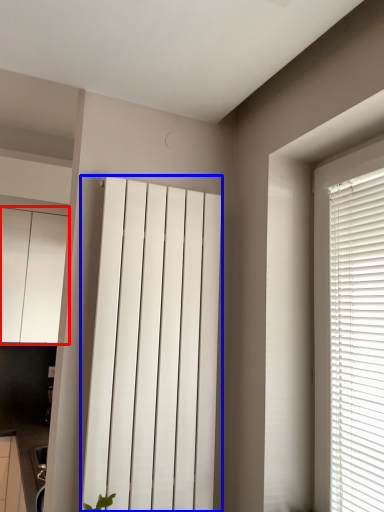
Question: Which of the following is the closest to the observer, cabinetry (highlighted by a red box) or curtain (highlighted by a blue box)?

Choices:
 (A) cabinetry
 (B) curtain

Answer: (B)